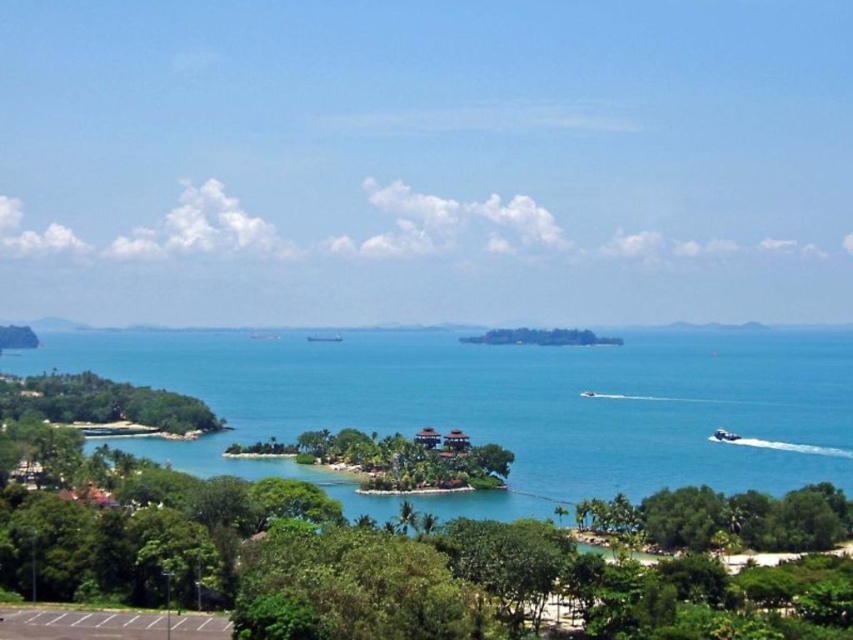
Is green leafy tree at lower right further to camera compared to white glossy boat at lower right?

No, it is not.

Does point (627, 499) come closer to viewer compared to point (720, 433)?

That is True.

You are a GUI agent. You are given a task and a screenshot of the screen. Output one action in this format:
    pyautogui.click(x=<x>, y=<y>)
    Task: Click on the green leafy tree at lower right
    The width and height of the screenshot is (853, 640).
    Given the screenshot: What is the action you would take?
    pyautogui.click(x=724, y=516)

Can you confirm if green leafy tree at lower left is smaller than white glossy boat at lower right?

Actually, green leafy tree at lower left might be larger than white glossy boat at lower right.

Between green leafy tree at lower left and white glossy boat at lower right, which one is positioned lower?

Positioned lower is white glossy boat at lower right.

Is point (132, 412) positioned behind point (730, 435)?

Yes, point (132, 412) is behind point (730, 435).

Locate an element on the screen. The image size is (853, 640). green leafy tree at lower left is located at coordinates (102, 403).

Can you confirm if blue water at center is smaller than white glossy boat at lower right?

No.

Is point (750, 484) less distant than point (734, 433)?

Yes, point (750, 484) is in front of point (734, 433).

Identify the location of blue water at center. The image size is (853, 640). (503, 406).

Locate an element on the screen. This screenshot has width=853, height=640. blue water at center is located at coordinates (503, 406).